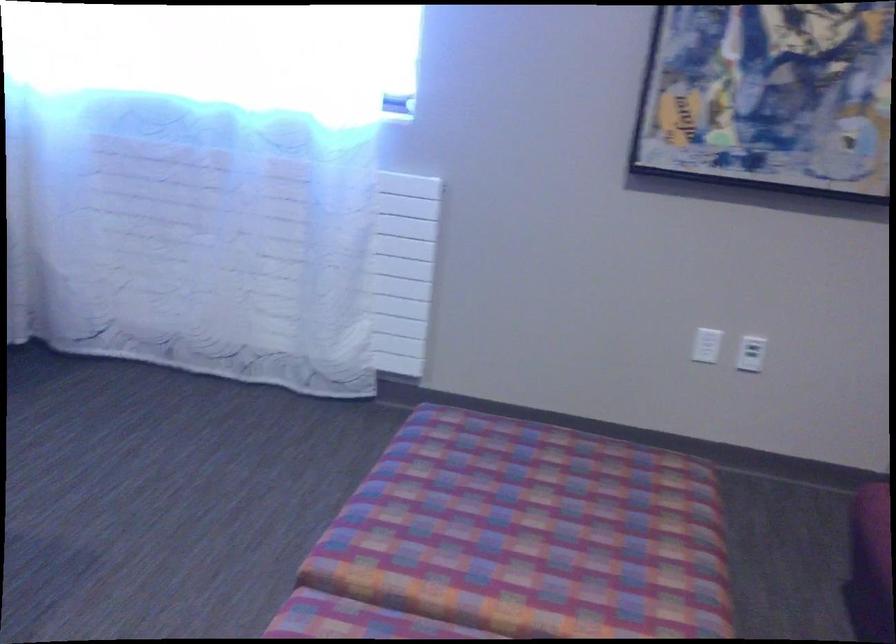
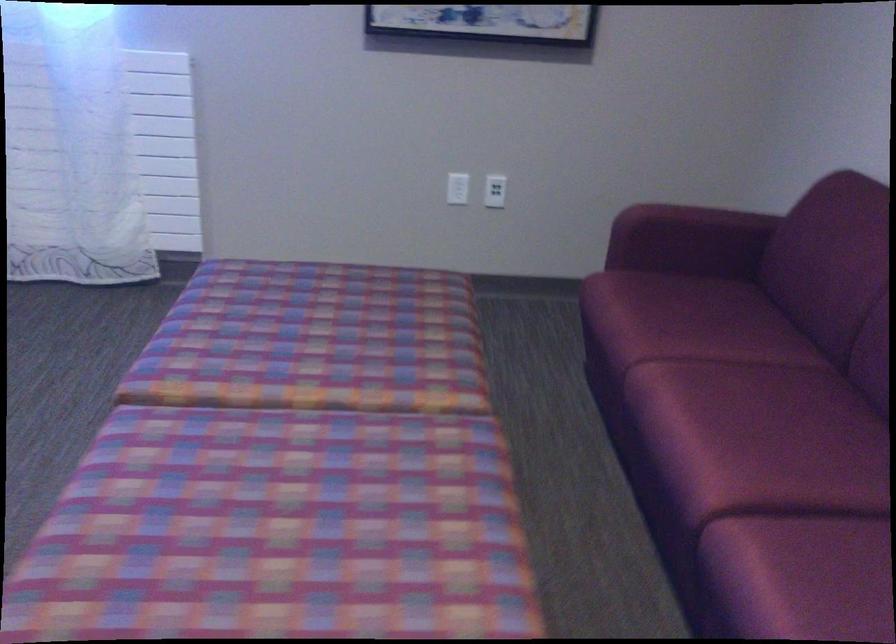
Where in the second image is the point corresponding to point (704, 346) from the first image?

(458, 187)